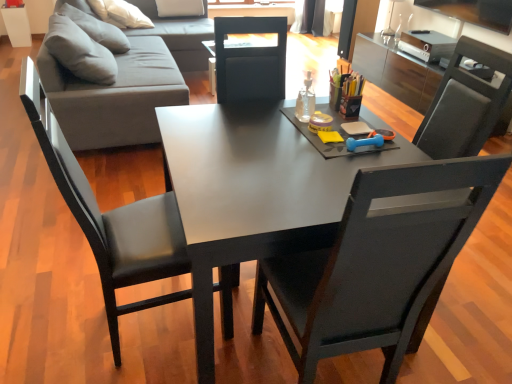
What do you see at coordinates (305, 100) in the screenshot? This screenshot has height=384, width=512. I see `transparent glass bottle at center` at bounding box center [305, 100].

Image resolution: width=512 pixels, height=384 pixels. What are the coordinates of `matte black desk at center` in the screenshot? It's located at (252, 193).

This screenshot has width=512, height=384. I want to click on transparent glass bottle at center, so click(305, 100).

Starting from the gray fabric couch at upper left, which chair is the 2nd one to the right? Please provide its 2D coordinates.

[(376, 262)]

Considering the relative sizes of gray fabric couch at upper left and black leather chair at center, arranged as the 2th chair when viewed from the left, in the image provided, is gray fabric couch at upper left thinner than black leather chair at center, arranged as the 2th chair when viewed from the left,?

No, gray fabric couch at upper left is not thinner than black leather chair at center, arranged as the 2th chair when viewed from the left.

How much distance is there between gray fabric couch at upper left and black leather chair at center, arranged as the 2th chair when viewed from the left?

gray fabric couch at upper left is 7.12 feet away from black leather chair at center, arranged as the 2th chair when viewed from the left.

In the image, is matte black desk at center positioned in front of or behind black leather chair at left, arranged as the 1th chair when viewed from the left?

In the image, matte black desk at center appears behind black leather chair at left, arranged as the 1th chair when viewed from the left.

Which object is positioned more to the left, matte black desk at center or black leather chair at left, the 2th chair positioned from the right?

black leather chair at left, the 2th chair positioned from the right.

Considering the sizes of objects transparent glass bottle at center and gray fabric couch at upper left in the image provided, who is wider, transparent glass bottle at center or gray fabric couch at upper left?

Wider between the two is gray fabric couch at upper left.

Do you think transparent glass bottle at center is within gray fabric couch at upper left, or outside of it?

The correct answer is: outside.

Does point (302, 90) appear closer or farther from the camera than point (72, 82)?

Clearly, point (302, 90) is closer to the camera than point (72, 82).

In terms of height, does transparent glass bottle at center look taller or shorter compared to gray fabric couch at upper left?

In the image, transparent glass bottle at center appears to be shorter than gray fabric couch at upper left.

Is the surface of black glossy tv at upper right in direct contact with gray fabric couch at upper left?

No, black glossy tv at upper right is not next to gray fabric couch at upper left.

Which is farther, (428,7) or (133,48)?

The point (428,7) is farther.

From the image's perspective, is black glossy tv at upper right below gray fabric couch at upper left?

Incorrect, from the image's perspective, black glossy tv at upper right is higher than gray fabric couch at upper left.

Is black glossy tv at upper right closer to the viewer compared to gray fabric couch at upper left?

No.

Does point (133, 132) come farther from viewer compared to point (309, 107)?

Yes, it is behind point (309, 107).

Could you tell me if gray fabric couch at upper left is facing transparent glass bottle at center?

No, gray fabric couch at upper left is not facing towards transparent glass bottle at center.

Does gray fabric couch at upper left appear on the right side of transparent glass bottle at center?

No.

Is black leather chair at left, arranged as the 1th chair when viewed from the left, facing away from matte black desk at center?

No, black leather chair at left, arranged as the 1th chair when viewed from the left,'s orientation is not away from matte black desk at center.

Considering the sizes of black leather chair at left, the 2th chair positioned from the right, and matte black desk at center in the image, is black leather chair at left, the 2th chair positioned from the right, wider or thinner than matte black desk at center?

Clearly, black leather chair at left, the 2th chair positioned from the right, has less width compared to matte black desk at center.

Is black leather chair at left, the 2th chair positioned from the right, situated inside matte black desk at center or outside?

The correct answer is: outside.

Considering the relative sizes of black leather chair at left, arranged as the 1th chair when viewed from the left, and matte black desk at center in the image provided, is black leather chair at left, arranged as the 1th chair when viewed from the left, taller than matte black desk at center?

Yes.

Which is more to the right, black leather chair at left, the 2th chair positioned from the right, or black leather chair at center, arranged as the 2th chair when viewed from the left?

Positioned to the right is black leather chair at center, arranged as the 2th chair when viewed from the left.

Between black leather chair at left, the 2th chair positioned from the right, and black leather chair at center, arranged as the 2th chair when viewed from the left, which one has less height?

Standing shorter between the two is black leather chair at left, the 2th chair positioned from the right.

This screenshot has height=384, width=512. What are the coordinates of `chair above the black leather chair at left, arranged as the 1th chair when viewed from the left (from a real-world perspective)` in the screenshot? It's located at (x=376, y=262).

Is black leather chair at left, arranged as the 1th chair when viewed from the left, further to the viewer compared to black leather chair at center, arranged as the 2th chair when viewed from the left?

Yes, black leather chair at left, arranged as the 1th chair when viewed from the left, is further from the camera.

The width and height of the screenshot is (512, 384). Identify the location of the 2nd chair counting from the right side of the gray fabric couch at upper left. (376, 262).

At what (x,y) coordinates should I click in order to perform the action: click on the 1st chair in front when counting from the matte black desk at center. Please return your answer as a coordinate pair (x, y). This screenshot has width=512, height=384. Looking at the image, I should click on click(x=111, y=219).

Looking at the image, which one is located closer to black leather chair at center, arranged as the 2th chair when viewed from the left, black glossy tv at upper right or transparent glass bottle at center?

transparent glass bottle at center is closer to black leather chair at center, arranged as the 2th chair when viewed from the left.

Estimate the real-world distances between objects in this image. Which object is closer to matte black desk at center, black leather chair at left, the 2th chair positioned from the right, or gray fabric couch at upper left?

Among the two, black leather chair at left, the 2th chair positioned from the right, is located nearer to matte black desk at center.

Estimate the real-world distances between objects in this image. Which object is closer to black glossy tv at upper right, gray fabric couch at upper left or matte black desk at center?

Among the two, gray fabric couch at upper left is located nearer to black glossy tv at upper right.

Which object lies further to the anchor point transparent glass bottle at center, black leather chair at left, the 2th chair positioned from the right, or gray fabric couch at upper left?

gray fabric couch at upper left lies further to transparent glass bottle at center than the other object.

From the image, which object appears to be farther from transparent glass bottle at center, black leather chair at center, arranged as the 2th chair when viewed from the left, or matte black desk at center?

black leather chair at center, arranged as the 2th chair when viewed from the left, is further to transparent glass bottle at center.

When comparing their distances from transparent glass bottle at center, does black leather chair at center, acting as the first chair starting from the right, or gray fabric couch at upper left seem further?

gray fabric couch at upper left is positioned further to the anchor transparent glass bottle at center.

When comparing their distances from black leather chair at center, arranged as the 2th chair when viewed from the left, does black leather chair at left, the 2th chair positioned from the right, or transparent glass bottle at center seem closer?

black leather chair at left, the 2th chair positioned from the right.

Considering their positions, is black leather chair at center, arranged as the 2th chair when viewed from the left, positioned closer to black glossy tv at upper right than gray fabric couch at upper left?

gray fabric couch at upper left lies closer to black glossy tv at upper right than the other object.

The height and width of the screenshot is (384, 512). What are the coordinates of `desk between black leather chair at left, the 2th chair positioned from the right, and gray fabric couch at upper left, along the z-axis` in the screenshot? It's located at pos(252,193).

This screenshot has width=512, height=384. Find the location of `bottle positioned between black leather chair at left, arranged as the 1th chair when viewed from the left, and black glossy tv at upper right from near to far`. bottle positioned between black leather chair at left, arranged as the 1th chair when viewed from the left, and black glossy tv at upper right from near to far is located at coordinates (305, 100).

Identify the location of desk situated between gray fabric couch at upper left and black glossy tv at upper right from left to right. (252, 193).

The width and height of the screenshot is (512, 384). Find the location of `bottle between black leather chair at center, acting as the first chair starting from the right, and black glossy tv at upper right, along the z-axis`. bottle between black leather chair at center, acting as the first chair starting from the right, and black glossy tv at upper right, along the z-axis is located at coordinates (305, 100).